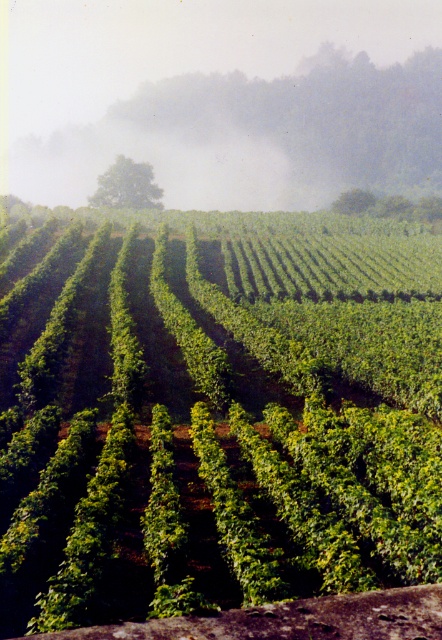
Question: Among these points, which one is nearest to the camera?

Choices:
 (A) (117, 116)
 (B) (362, 369)

Answer: (B)

Question: Is green leafy vines at center in front of foggy mist at upper center?

Choices:
 (A) no
 (B) yes

Answer: (B)

Question: Can you confirm if green leafy vines at center is positioned below foggy mist at upper center?

Choices:
 (A) yes
 (B) no

Answer: (A)

Question: Is green leafy vines at center smaller than foggy mist at upper center?

Choices:
 (A) no
 (B) yes

Answer: (B)